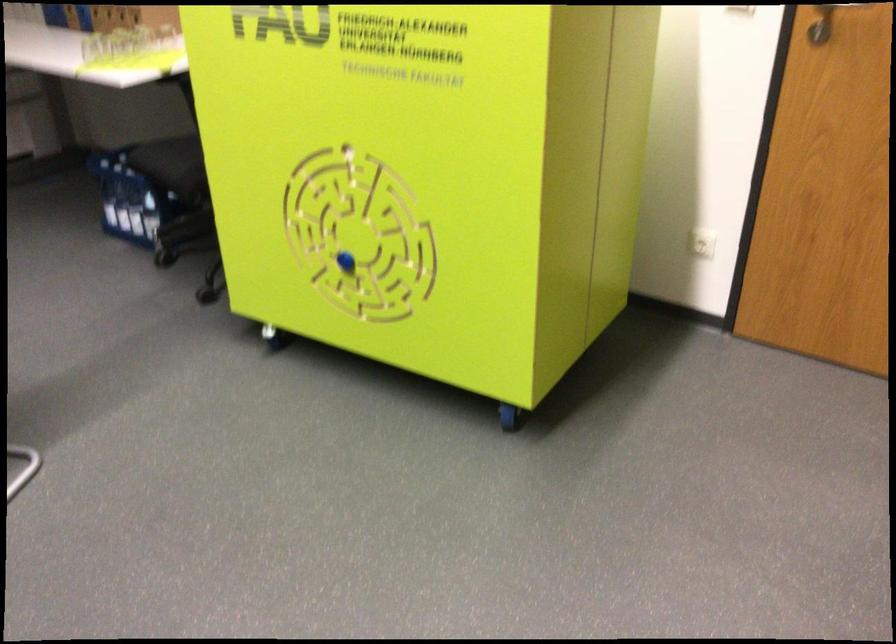
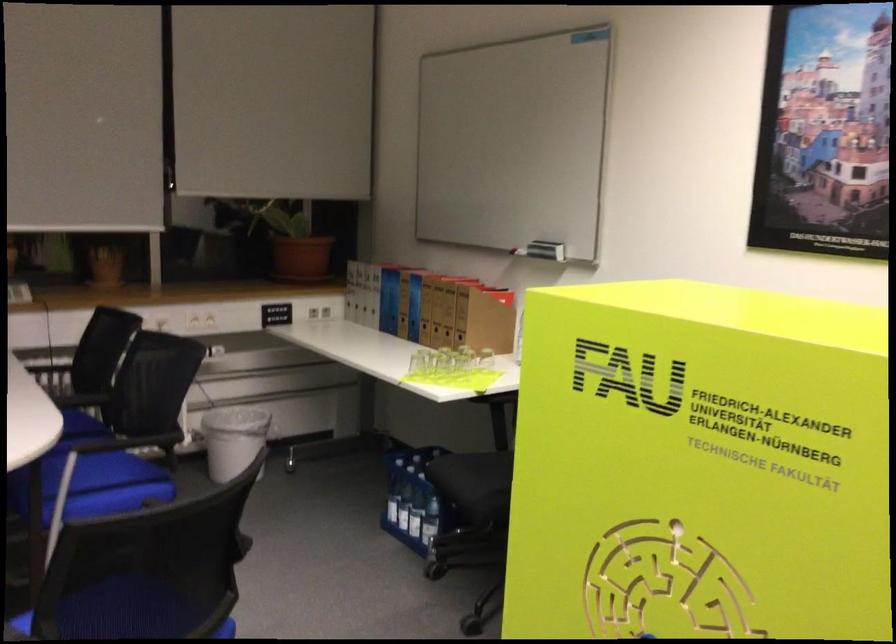
Find the pixel in the second image that matches point 152,213 in the first image.

(429, 520)